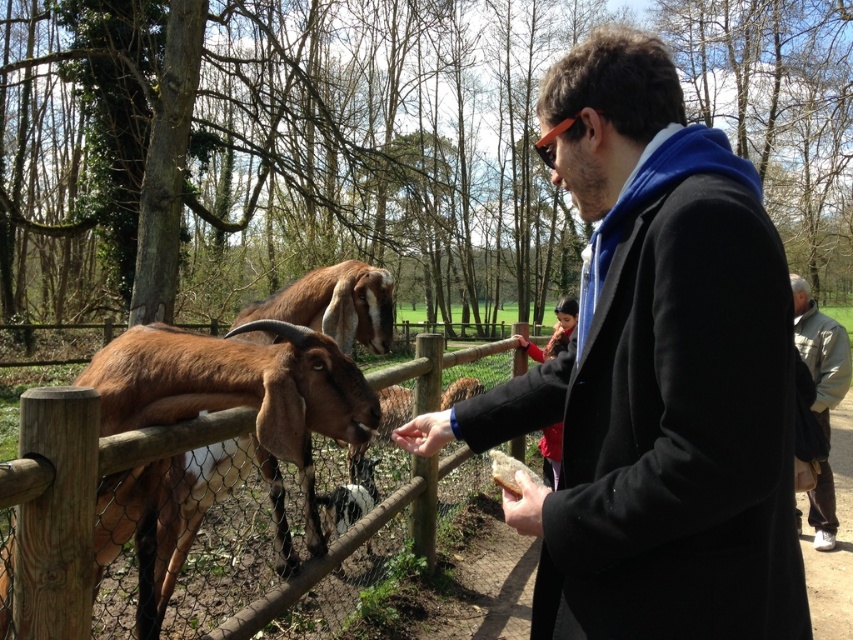
Is black wool coat at center in front of wooden fence at left?

Yes, black wool coat at center is in front of wooden fence at left.

Between black wool coat at center and wooden fence at left, which one has more height?

Standing taller between the two is black wool coat at center.

Between point (587, 339) and point (49, 536), which one is positioned in front?

Point (587, 339) is more forward.

Identify the location of black wool coat at center. This screenshot has height=640, width=853. point(656,374).

Which is in front, point (828, 365) or point (515, 506)?

Point (515, 506) is in front.

Can you confirm if light gray jacket at right is thinner than smooth brown leather hand at lower center?

No, light gray jacket at right is not thinner than smooth brown leather hand at lower center.

Is point (828, 397) in front of point (538, 497)?

That is False.

I want to click on light gray jacket at right, so click(x=820, y=352).

Which is more to the left, black wool coat at center or smooth brown leather hand at lower center?

smooth brown leather hand at lower center

Who is positioned more to the right, black wool coat at center or smooth brown leather hand at lower center?

black wool coat at center

Is point (787, 406) in front of point (537, 532)?

Yes, it is.

The height and width of the screenshot is (640, 853). In order to click on black wool coat at center in this screenshot , I will do (x=656, y=374).